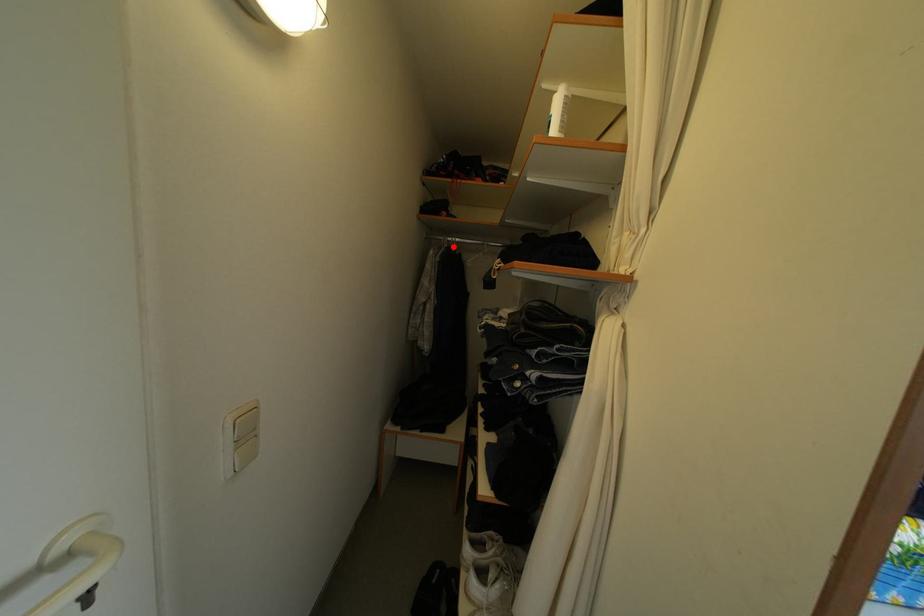
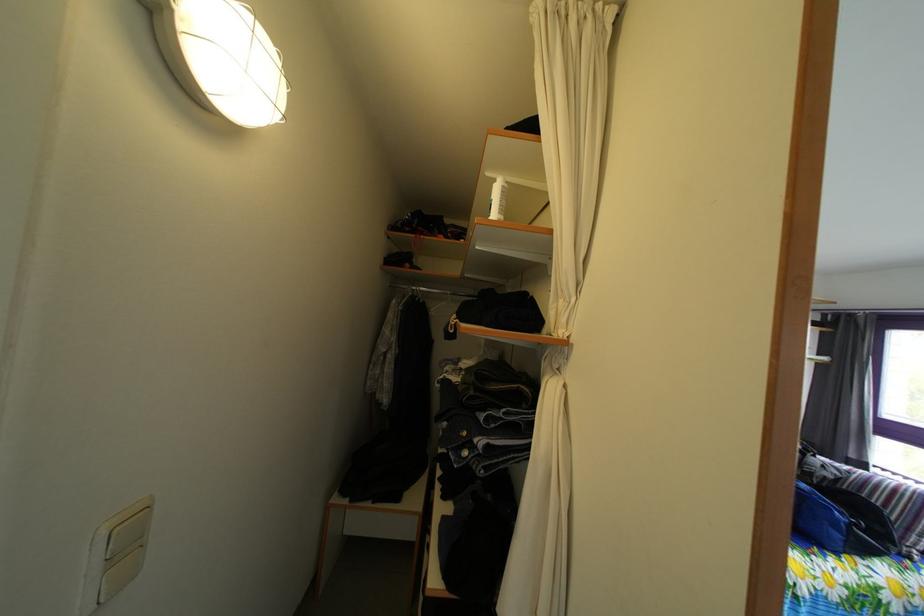
In the second image, find the point that corresponds to the highlighted location in the first image.

(418, 294)